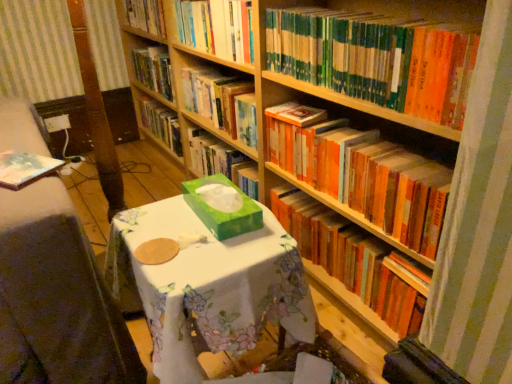
This screenshot has height=384, width=512. What are the coordinates of `free space that is to the left of green matte tissue box at center` in the screenshot? It's located at click(159, 222).